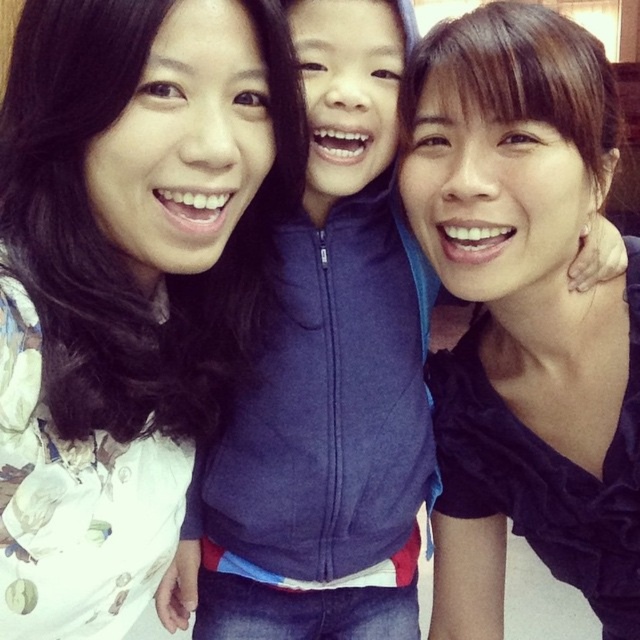
Question: Does matte black top at center have a larger size compared to blue fleece jacket at center?

Choices:
 (A) no
 (B) yes

Answer: (A)

Question: Which of the following is the closest to the observer?

Choices:
 (A) (68, 170)
 (B) (420, 237)

Answer: (A)

Question: Which point is closer to the camera?

Choices:
 (A) matte black top at center
 (B) blue fleece jacket at center
 (C) white floral shirt at upper left

Answer: (C)

Question: Is white floral shirt at upper left to the right of matte black top at center from the viewer's perspective?

Choices:
 (A) yes
 (B) no

Answer: (B)

Question: Is white floral shirt at upper left to the left of matte black top at center from the viewer's perspective?

Choices:
 (A) yes
 (B) no

Answer: (A)

Question: Which object is positioned closest to the matte black top at center?

Choices:
 (A) white floral shirt at upper left
 (B) blue fleece jacket at center

Answer: (B)